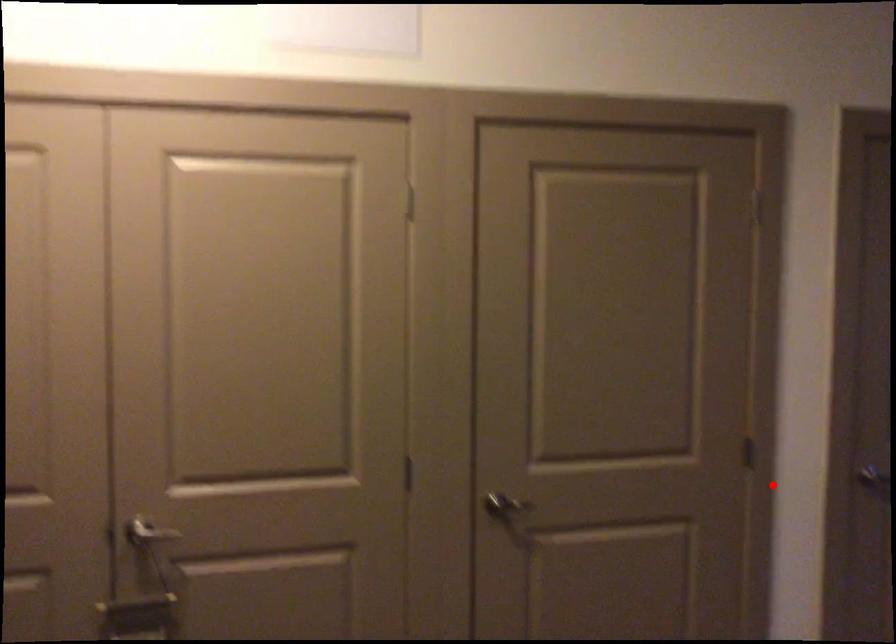
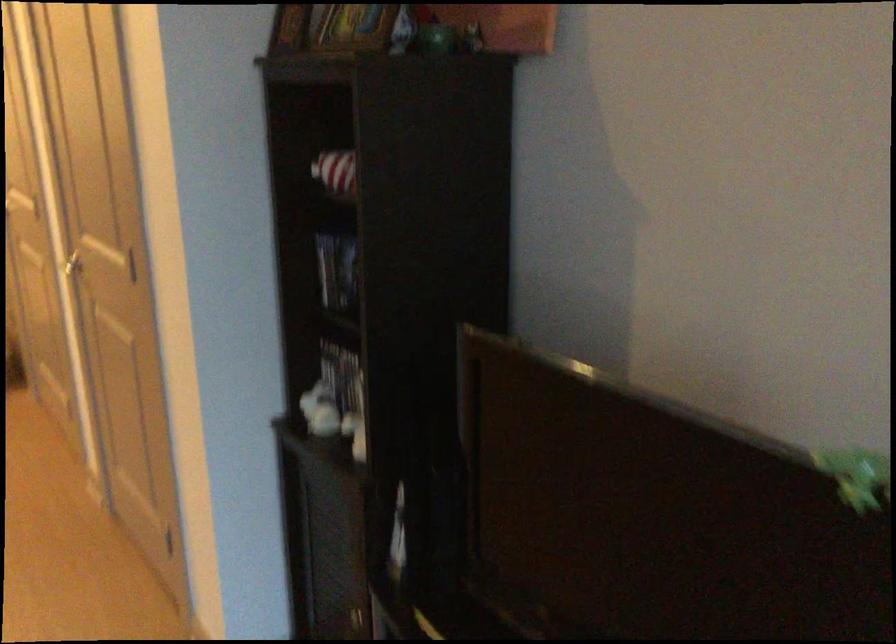
Locate, in the second image, the point that corresponds to the highlighted location in the first image.

(73, 267)